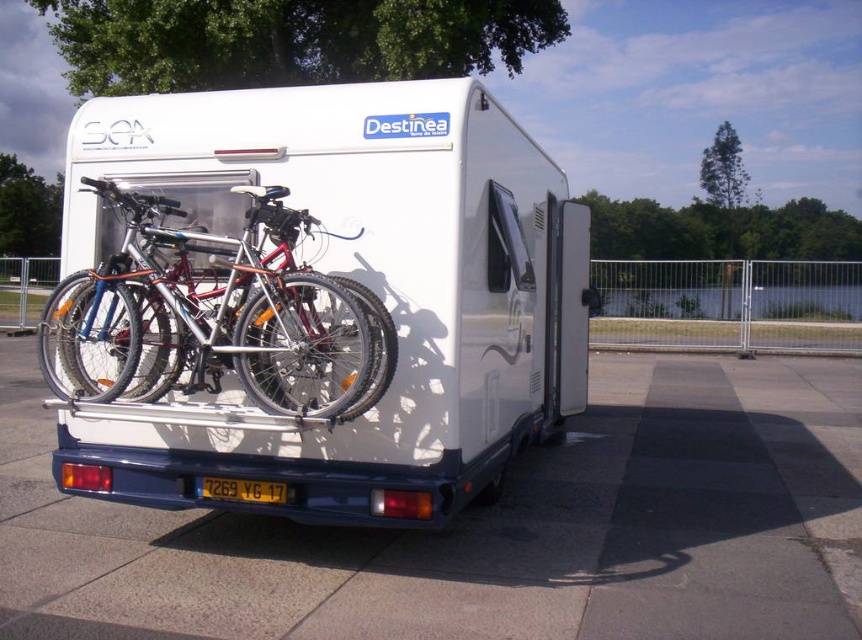
Question: Which of the following is the closest to the observer?

Choices:
 (A) white glossy van at center
 (B) yellow matte license plate at center
 (C) silver metallic bicycle at center

Answer: (C)

Question: Which object is closer to the camera taking this photo?

Choices:
 (A) silver metallic bicycle at center
 (B) yellow matte license plate at center
 (C) white glossy van at center

Answer: (A)

Question: Is white glossy van at center thinner than yellow matte license plate at center?

Choices:
 (A) yes
 (B) no

Answer: (B)

Question: Does white glossy van at center have a lesser width compared to silver metallic bicycle at center?

Choices:
 (A) no
 (B) yes

Answer: (A)

Question: Is silver metallic bicycle at center smaller than yellow matte license plate at center?

Choices:
 (A) no
 (B) yes

Answer: (A)

Question: Estimate the real-world distances between objects in this image. Which object is farther from the yellow matte license plate at center?

Choices:
 (A) white glossy van at center
 (B) silver metallic bicycle at center

Answer: (A)